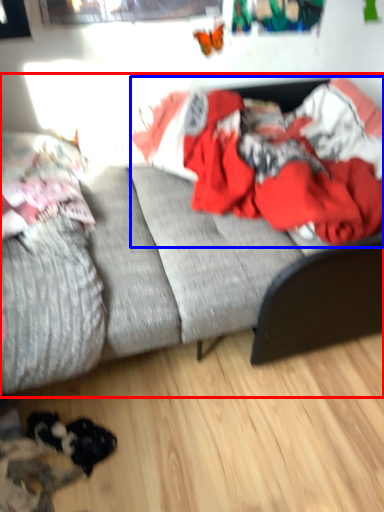
Question: Which point is further to the camera, studio couch (highlighted by a red box) or clothing (highlighted by a blue box)?

Choices:
 (A) studio couch
 (B) clothing

Answer: (B)